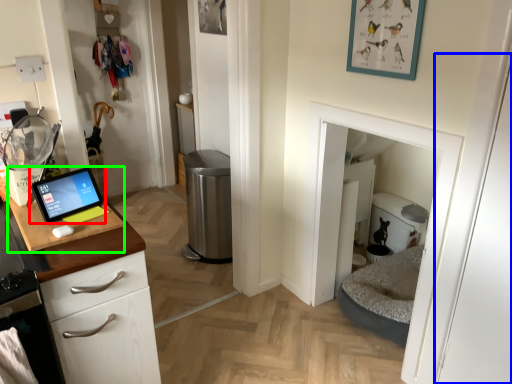
Question: Estimate the real-world distances between objects in this image. Which object is closer to tablet computer (highlighted by a red box), door (highlighted by a blue box) or sink (highlighted by a green box)?

Choices:
 (A) door
 (B) sink

Answer: (B)